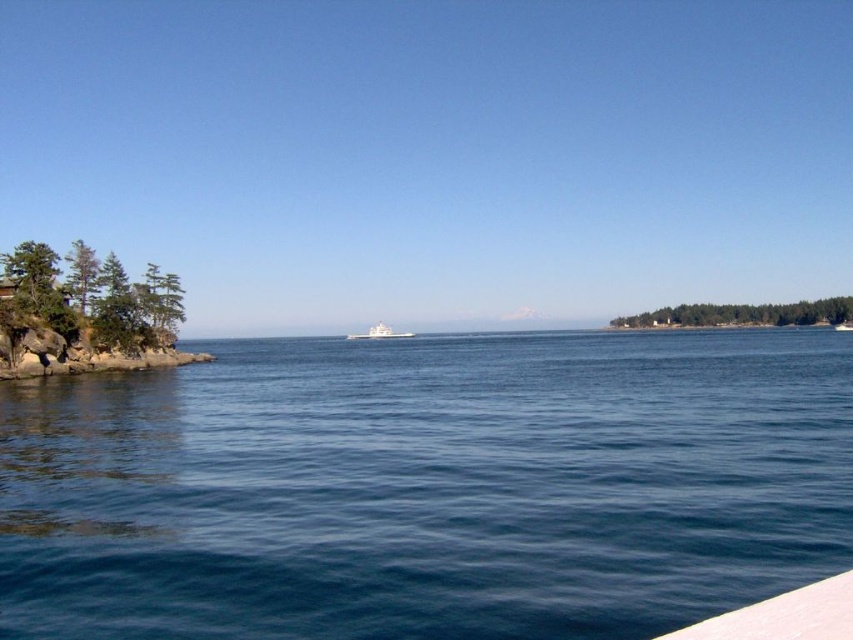
You are standing on the rocky shoreline on the left side of the image. You want to reach the blue water at center marked by point (427, 486). Which direction should you walk to get there?

You should walk towards the center of the image to reach the blue water at center marked by point (427, 486).

Consider the image. You are standing at point (84, 314) in the coastal scene. What do you see around you?

You see green textured rocks at left around you.